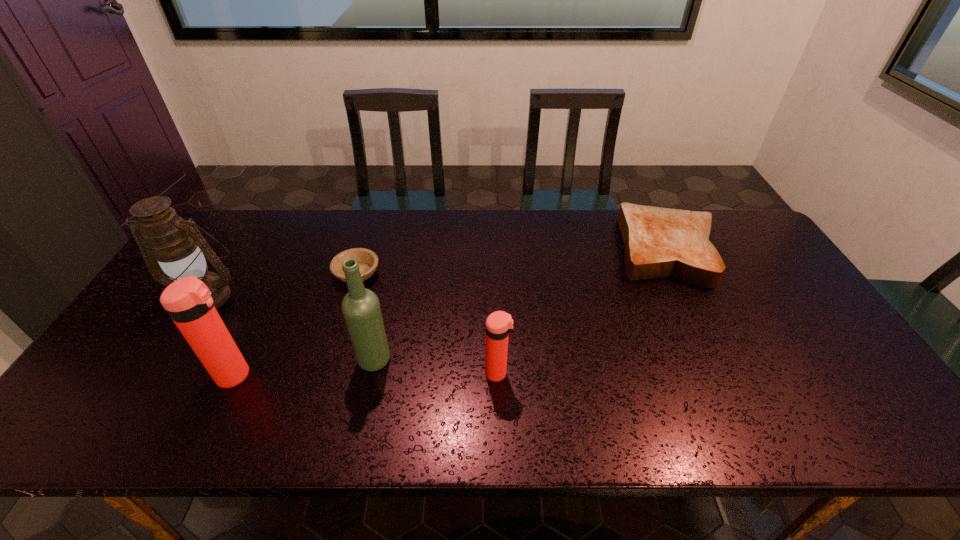
The height and width of the screenshot is (540, 960). What are the coordinates of `vacant area at the far edge of the desktop` in the screenshot? It's located at (437, 239).

Locate an element on the screen. This screenshot has width=960, height=540. vacant space at the near edge of the desktop is located at coordinates (325, 372).

Find the location of a particular element. The height and width of the screenshot is (540, 960). free space at the left edge is located at coordinates (160, 361).

Locate an element on the screen. Image resolution: width=960 pixels, height=540 pixels. blank space at the right edge of the desktop is located at coordinates (757, 264).

Find the location of a particular element. The image size is (960, 540). blank space at the far left corner is located at coordinates (242, 242).

Locate an element on the screen. This screenshot has width=960, height=540. free area in between the fifth tallest object and the wine bottle is located at coordinates (521, 305).

You are a GUI agent. You are given a task and a screenshot of the screen. Output one action in this format:
    pyautogui.click(x=<x>, y=<y>)
    Task: Click on the vacant space that is in between the leftmost object and the fifth tallest object
    
    Given the screenshot: What is the action you would take?
    pyautogui.click(x=437, y=273)

The width and height of the screenshot is (960, 540). I want to click on free space between the second object from left to right and the rightmost object, so click(x=451, y=313).

Where is `vacant space that's between the wine bottle and the third shortest object`? vacant space that's between the wine bottle and the third shortest object is located at coordinates (436, 367).

The height and width of the screenshot is (540, 960). I want to click on free space between the fifth object from right to left and the second object from right to left, so click(x=367, y=374).